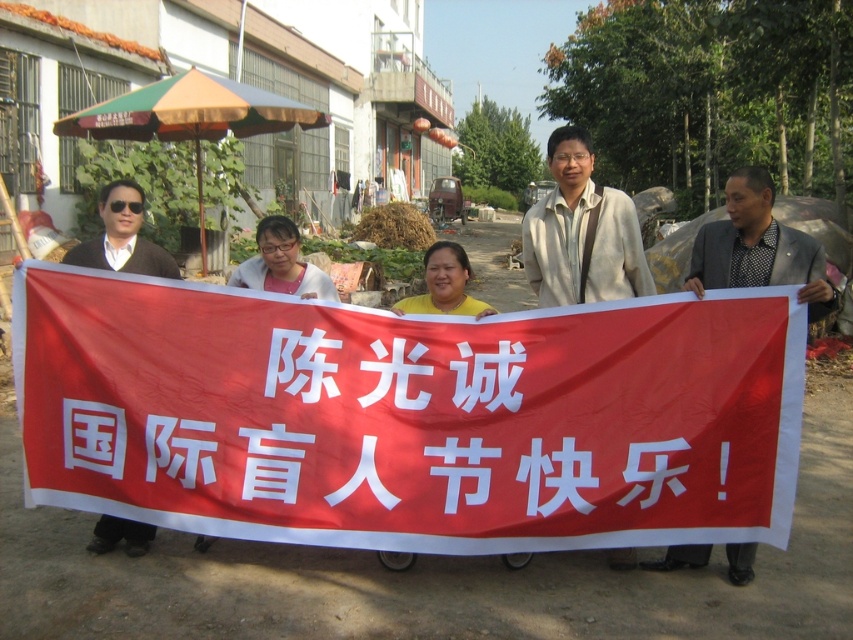
You are standing at the point marked by the coordinates point (584, 346). You want to throw a ball to someone standing 4 meters away from you. Can you reach them with your throw?

The distance between you and the viewer is 3.96 meters, so yes, you can reach them with your throw since it is slightly less than 4 meters.